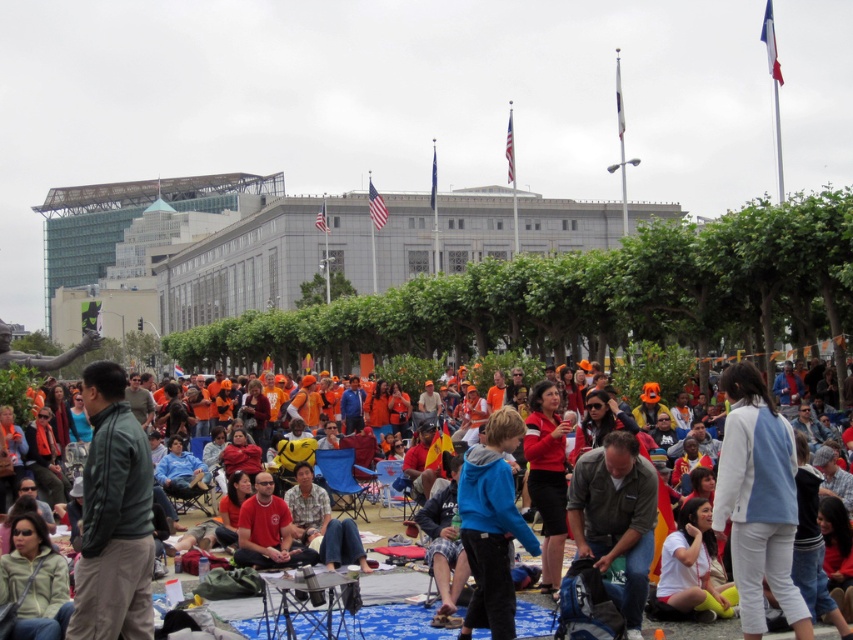
Consider the image. Which is above, green matte jacket at lower left or matte black jacket at center?

Positioned higher is green matte jacket at lower left.

Is green matte jacket at lower left smaller than matte black jacket at center?

Yes, green matte jacket at lower left is smaller than matte black jacket at center.

This screenshot has width=853, height=640. What are the coordinates of `green matte jacket at lower left` in the screenshot? It's located at (113, 516).

Who is higher up, green matte jacket at lower left or blue fleece jacket at center?

green matte jacket at lower left is above.

Who is more forward, (96,481) or (492,634)?

Point (96,481) is in front.

At what (x,y) coordinates should I click in order to perform the action: click on green matte jacket at lower left. Please return your answer as a coordinate pair (x, y). Looking at the image, I should click on (113, 516).

Is point (741, 509) positioned behind point (599, 538)?

No, it is not.

Can you confirm if white cotton jacket at right is positioned to the left of matte khaki shirt at center?

In fact, white cotton jacket at right is to the right of matte khaki shirt at center.

Who is more forward, (770, 481) or (616, 480)?

Point (770, 481) is more forward.

The image size is (853, 640). What are the coordinates of `white cotton jacket at right` in the screenshot? It's located at (758, 500).